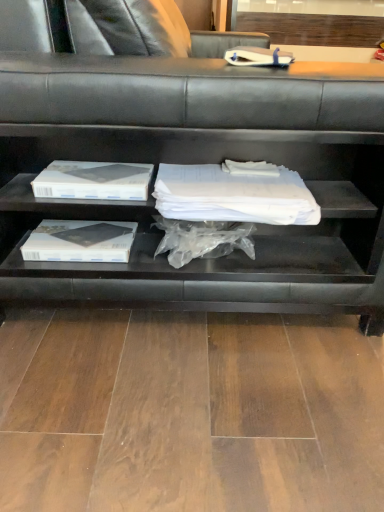
Question: Is black matte shelf at center inside white paper at upper center?

Choices:
 (A) yes
 (B) no

Answer: (B)

Question: Is white paper at upper center with black matte shelf at center?

Choices:
 (A) yes
 (B) no

Answer: (B)

Question: From the image's perspective, does white paper at upper center appear higher than black matte shelf at center?

Choices:
 (A) yes
 (B) no

Answer: (B)

Question: Is white paper at upper center smaller than black matte shelf at center?

Choices:
 (A) no
 (B) yes

Answer: (B)

Question: Considering the relative sizes of white paper at upper center and black matte shelf at center in the image provided, is white paper at upper center taller than black matte shelf at center?

Choices:
 (A) yes
 (B) no

Answer: (B)

Question: From a real-world perspective, is white paper at upper center on black matte shelf at center?

Choices:
 (A) yes
 (B) no

Answer: (A)

Question: Considering the relative sizes of black matte shelf at center and white paper at upper center in the image provided, is black matte shelf at center shorter than white paper at upper center?

Choices:
 (A) no
 (B) yes

Answer: (A)

Question: Is black matte shelf at center at the right side of white paper at upper center?

Choices:
 (A) no
 (B) yes

Answer: (A)

Question: Does black matte shelf at center lie behind white paper at upper center?

Choices:
 (A) no
 (B) yes

Answer: (A)

Question: From the image's perspective, does black matte shelf at center appear higher than white paper at upper center?

Choices:
 (A) yes
 (B) no

Answer: (A)

Question: From a real-world perspective, is black matte shelf at center over white paper at upper center?

Choices:
 (A) yes
 (B) no

Answer: (B)

Question: Is white paper at upper center inside black matte shelf at center?

Choices:
 (A) no
 (B) yes

Answer: (B)

Question: Is point click(x=266, y=141) positioned closer to the camera than point click(x=281, y=54)?

Choices:
 (A) closer
 (B) farther

Answer: (A)